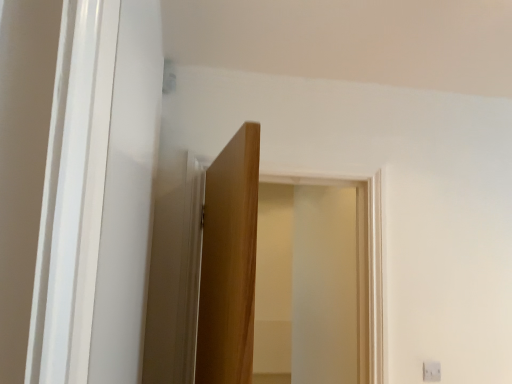
Question: Considering their positions, is white plastic light switch at lower right located in front of or behind transparent glass door at center?

Choices:
 (A) behind
 (B) front

Answer: (A)

Question: Is white plastic light switch at lower right taller or shorter than transparent glass door at center?

Choices:
 (A) short
 (B) tall

Answer: (A)

Question: Is white plastic light switch at lower right wider or thinner than transparent glass door at center?

Choices:
 (A) wide
 (B) thin

Answer: (B)

Question: Considering the relative positions of transparent glass door at center and white plastic light switch at lower right in the image provided, is transparent glass door at center to the left or to the right of white plastic light switch at lower right?

Choices:
 (A) left
 (B) right

Answer: (A)

Question: From their relative heights in the image, would you say transparent glass door at center is taller or shorter than white plastic light switch at lower right?

Choices:
 (A) short
 (B) tall

Answer: (B)

Question: Considering the positions of transparent glass door at center and white plastic light switch at lower right in the image, is transparent glass door at center wider or thinner than white plastic light switch at lower right?

Choices:
 (A) wide
 (B) thin

Answer: (A)

Question: From the image's perspective, relative to white plastic light switch at lower right, is transparent glass door at center above or below?

Choices:
 (A) below
 (B) above

Answer: (B)